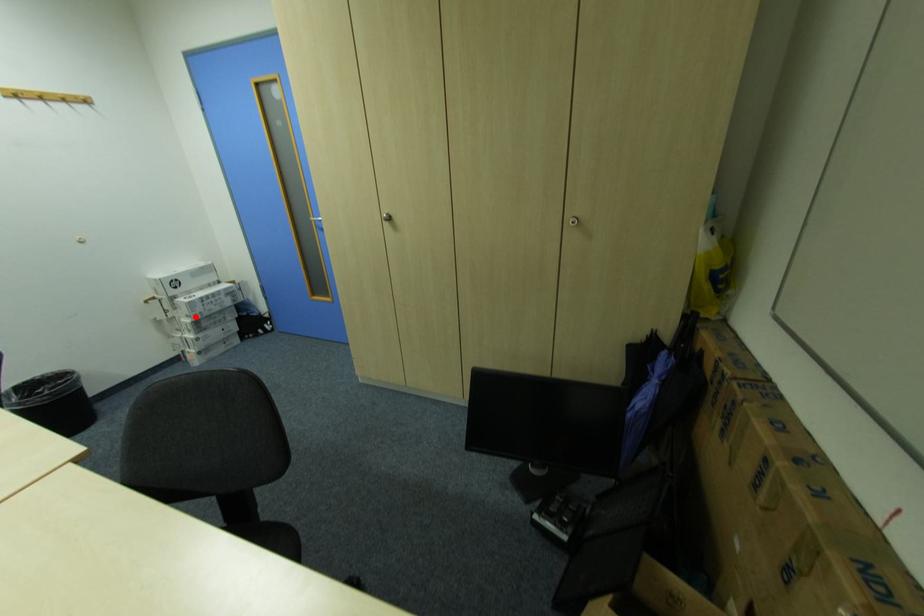
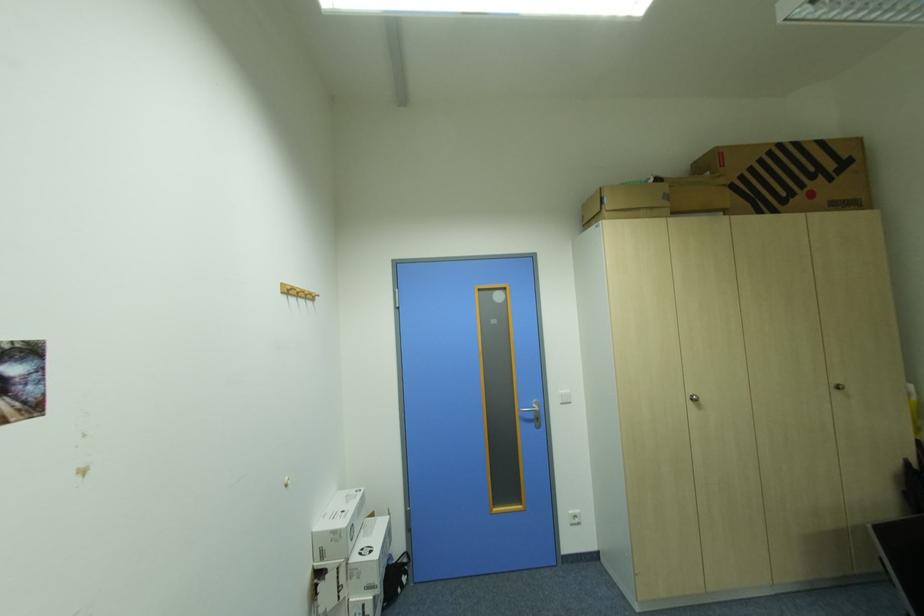
Question: I am providing you with two images of the same scene from different viewpoints. A red point is shown in image1. For the corresponding object point in image2, is it positioned nearer or farther from the camera?

Choices:
 (A) Nearer
 (B) Farther

Answer: (B)